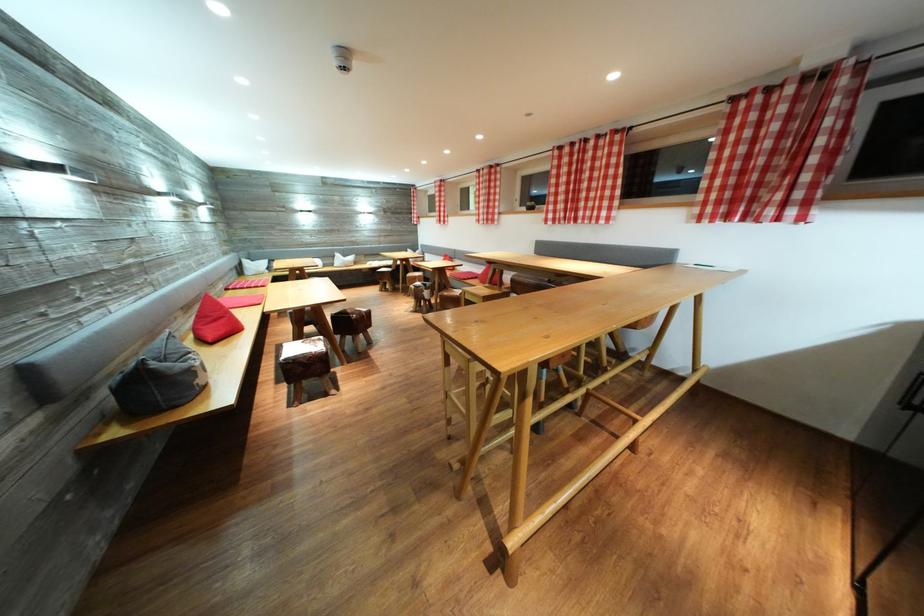
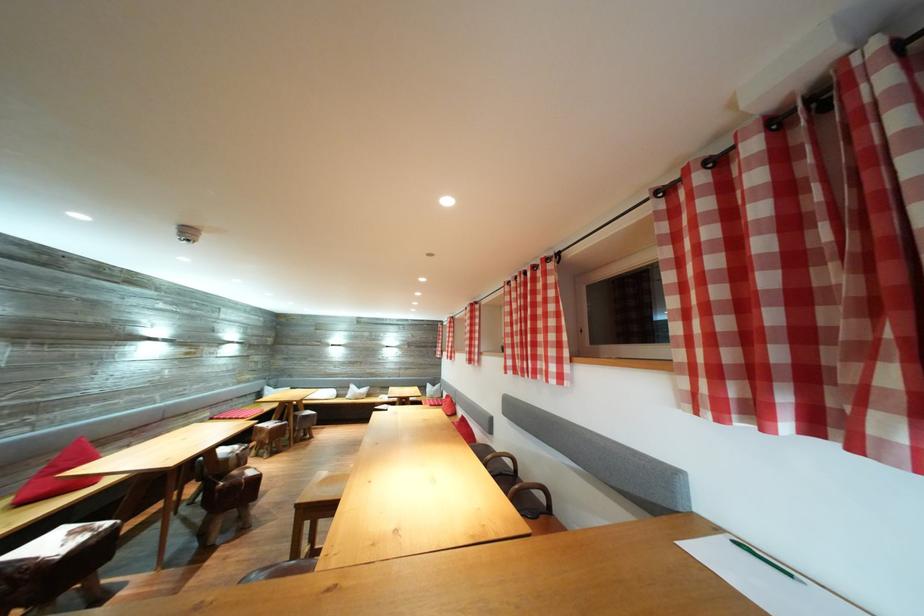
The point at (556, 222) is marked in the first image. Where is the corresponding point in the second image?

(517, 368)